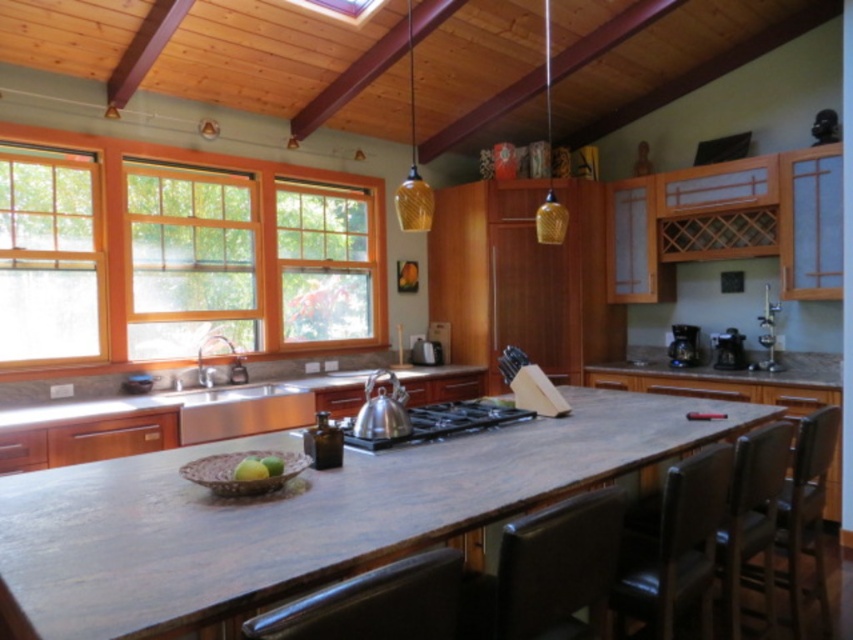
Question: Does orange wood window at center appear on the left side of brown leather chair at lower center?

Choices:
 (A) yes
 (B) no

Answer: (A)

Question: Which object appears farthest from the camera in this image?

Choices:
 (A) stainless steel kettle at center
 (B) orange wood window at center
 (C) clear glass window at center

Answer: (B)

Question: Is matte wood counter top at center wider than green matte apple at center?

Choices:
 (A) yes
 (B) no

Answer: (A)

Question: Which object appears closest to the camera in this image?

Choices:
 (A) green matte apple at center
 (B) leather at right
 (C) matte wood counter top at center

Answer: (B)

Question: Which of the following is the closest to the observer?

Choices:
 (A) dark brown leather chair at lower right
 (B) brown polished wood at right
 (C) leather at right

Answer: (C)

Question: Is brown leather chair at lower center positioned before stainless steel kettle at center?

Choices:
 (A) yes
 (B) no

Answer: (A)